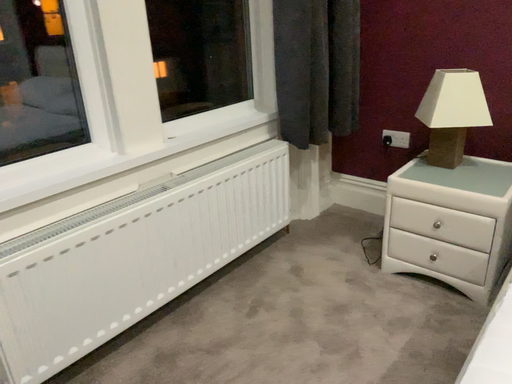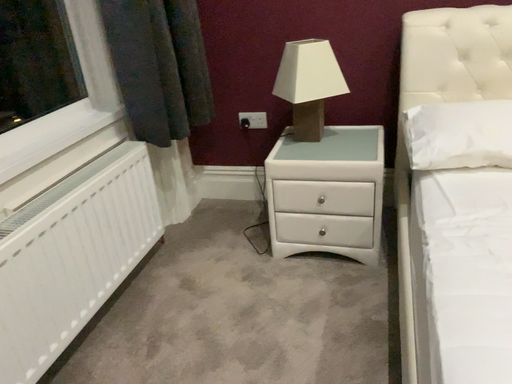
Question: How did the camera likely rotate when shooting the video?

Choices:
 (A) rotated right
 (B) rotated left

Answer: (A)